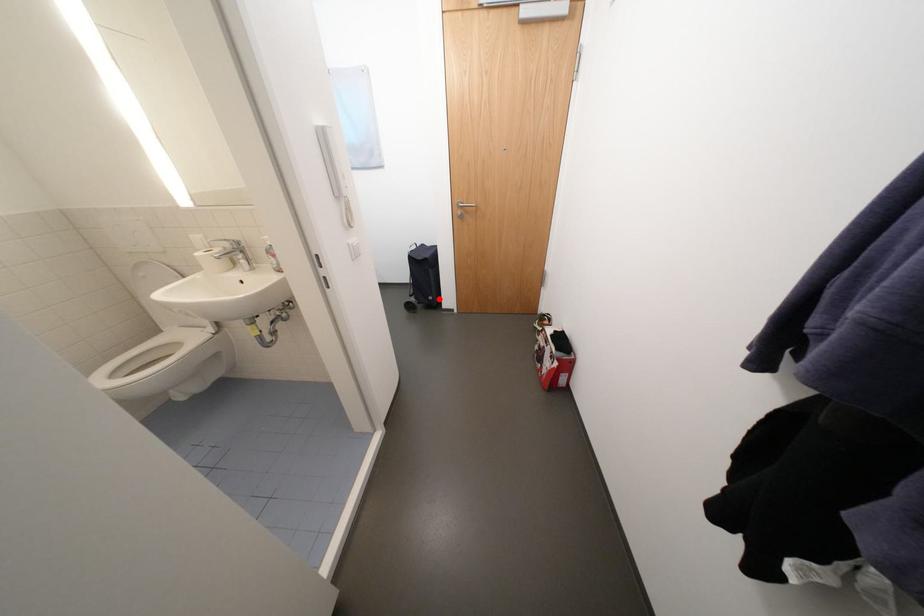
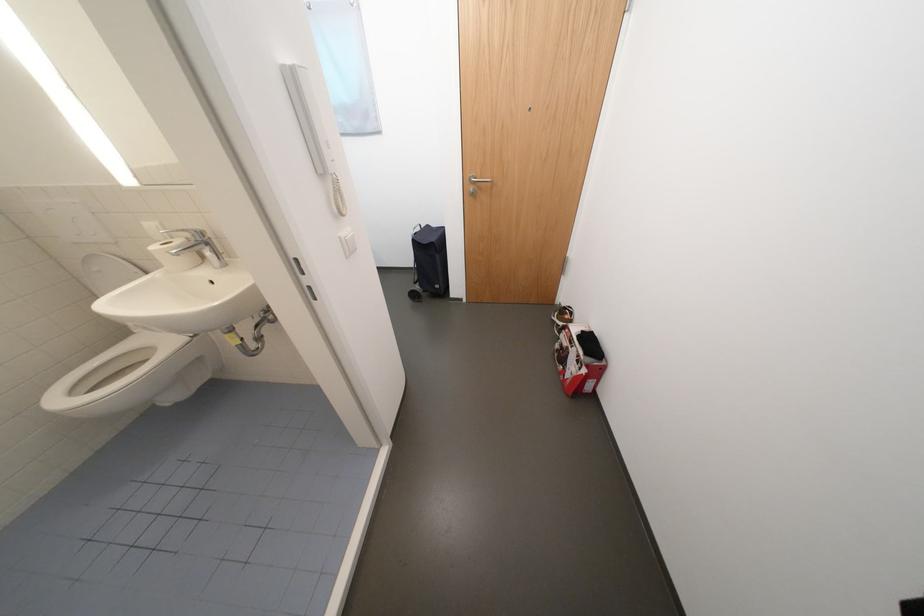
Locate, in the second image, the point that corresponds to the highlighted location in the first image.

(445, 286)